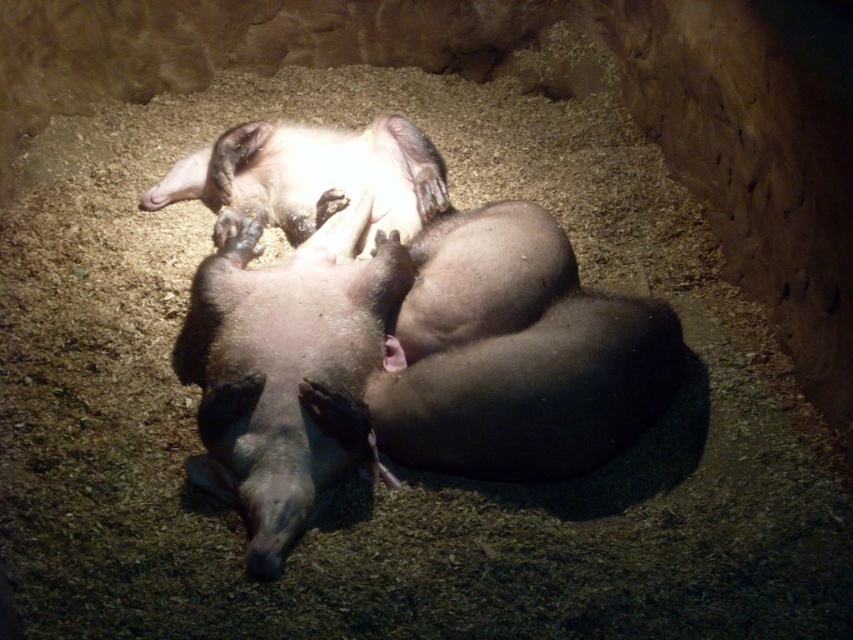
Can you confirm if smooth pink piglet at center is bigger than fur-like skin piglet at upper center?

Indeed, smooth pink piglet at center has a larger size compared to fur-like skin piglet at upper center.

What do you see at coordinates (288, 371) in the screenshot?
I see `smooth pink piglet at center` at bounding box center [288, 371].

The image size is (853, 640). Find the location of `smooth pink piglet at center`. smooth pink piglet at center is located at coordinates (288, 371).